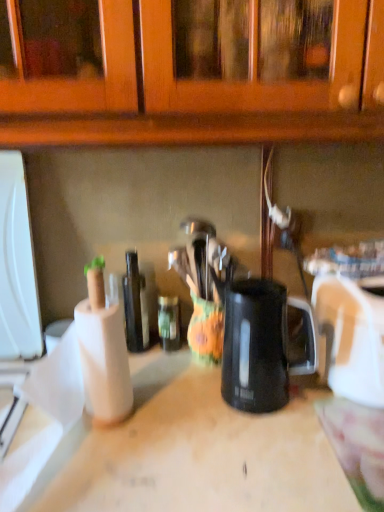
Image resolution: width=384 pixels, height=512 pixels. I want to click on blank space to the left of black plastic mug at center, so click(180, 417).